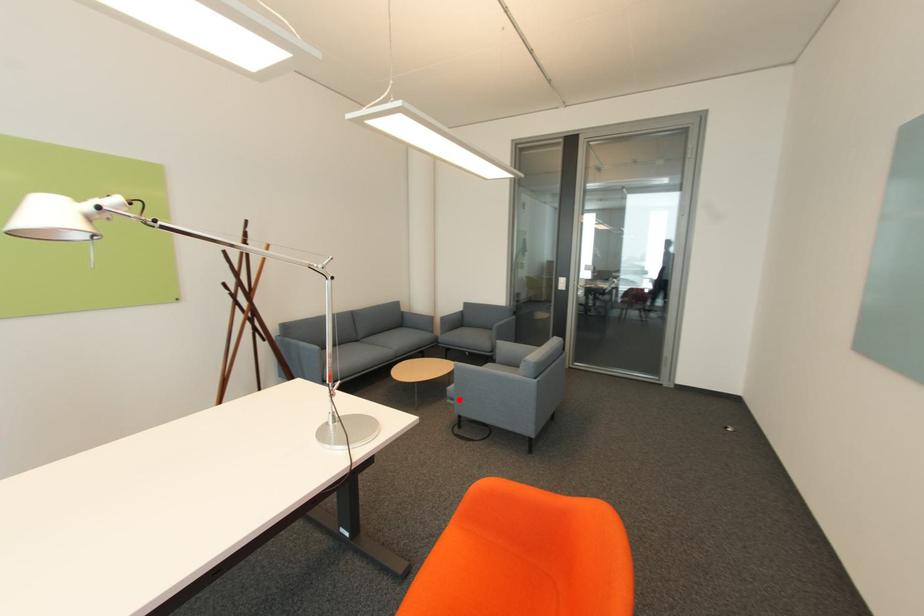
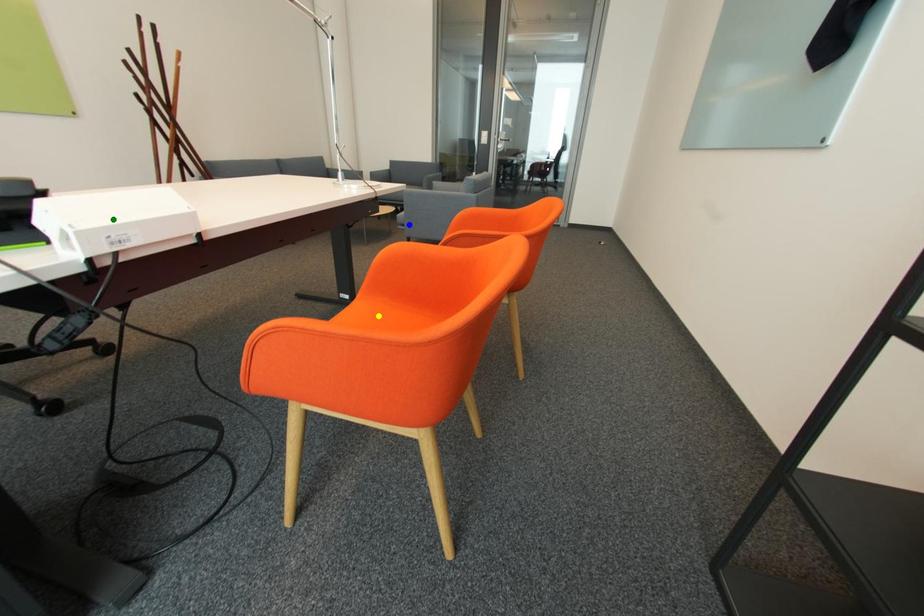
Question: I am providing you with two images of the same scene from different viewpoints. A red point is marked on the first image. You are given multiple points on the second image. Which spot in image 2 lines up with the point in image 1?

Choices:
 (A) blue point
 (B) green point
 (C) yellow point

Answer: (A)